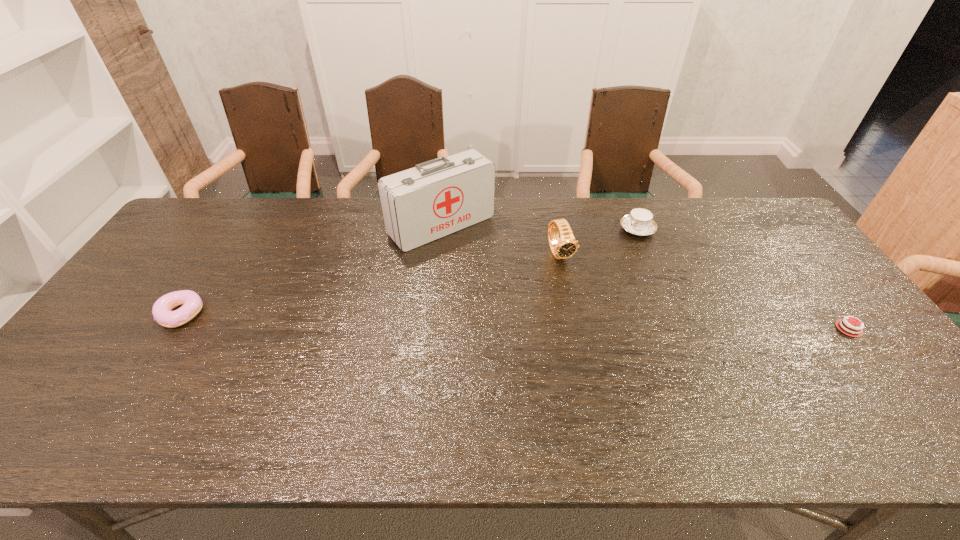
Select which object is the third closest to the first-aid kit. Please provide its 2D coordinates. Your answer should be formatted as a tuple, i.e. [(x, y)], where the tuple contains the x and y coordinates of a point satisfying the conditions above.

[(191, 301)]

Where is `vacant region that satisfies the following two spatial constraints: 1. on the front side of the second object from right to left; 2. on the left side of the tallest object`? The image size is (960, 540). vacant region that satisfies the following two spatial constraints: 1. on the front side of the second object from right to left; 2. on the left side of the tallest object is located at coordinates (442, 230).